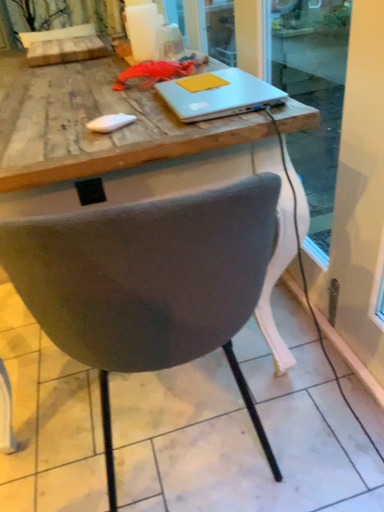
Question: Does yellow matte notepad at upper center appear on the right side of sleek white laptop at center?

Choices:
 (A) yes
 (B) no

Answer: (B)

Question: Considering the relative sizes of yellow matte notepad at upper center and sleek white laptop at center in the image provided, is yellow matte notepad at upper center taller than sleek white laptop at center?

Choices:
 (A) yes
 (B) no

Answer: (B)

Question: Is yellow matte notepad at upper center at the left side of sleek white laptop at center?

Choices:
 (A) no
 (B) yes

Answer: (B)

Question: Is yellow matte notepad at upper center in contact with sleek white laptop at center?

Choices:
 (A) no
 (B) yes

Answer: (B)

Question: Does yellow matte notepad at upper center have a lesser height compared to sleek white laptop at center?

Choices:
 (A) yes
 (B) no

Answer: (A)

Question: Considering their positions, is white textured curtain at upper left located in front of or behind sleek white laptop at center?

Choices:
 (A) behind
 (B) front

Answer: (A)

Question: From a real-world perspective, is white textured curtain at upper left positioned above or below sleek white laptop at center?

Choices:
 (A) below
 (B) above

Answer: (B)

Question: From the image's perspective, is white textured curtain at upper left above or below sleek white laptop at center?

Choices:
 (A) above
 (B) below

Answer: (A)

Question: Considering the positions of point (102, 28) and point (269, 93), is point (102, 28) closer or farther from the camera than point (269, 93)?

Choices:
 (A) farther
 (B) closer

Answer: (A)

Question: Based on their sizes in the image, would you say sleek white laptop at center is bigger or smaller than gray fabric chair at center?

Choices:
 (A) big
 (B) small

Answer: (B)

Question: Relative to gray fabric chair at center, is sleek white laptop at center in front or behind?

Choices:
 (A) front
 (B) behind

Answer: (B)

Question: From a real-world perspective, relative to gray fabric chair at center, is sleek white laptop at center vertically above or below?

Choices:
 (A) above
 (B) below

Answer: (A)

Question: From the image's perspective, is sleek white laptop at center positioned above or below gray fabric chair at center?

Choices:
 (A) below
 (B) above

Answer: (B)

Question: Considering the positions of sleek white laptop at center and yellow matte notepad at upper center in the image, is sleek white laptop at center bigger or smaller than yellow matte notepad at upper center?

Choices:
 (A) small
 (B) big

Answer: (B)

Question: Is sleek white laptop at center wider or thinner than yellow matte notepad at upper center?

Choices:
 (A) thin
 (B) wide

Answer: (B)